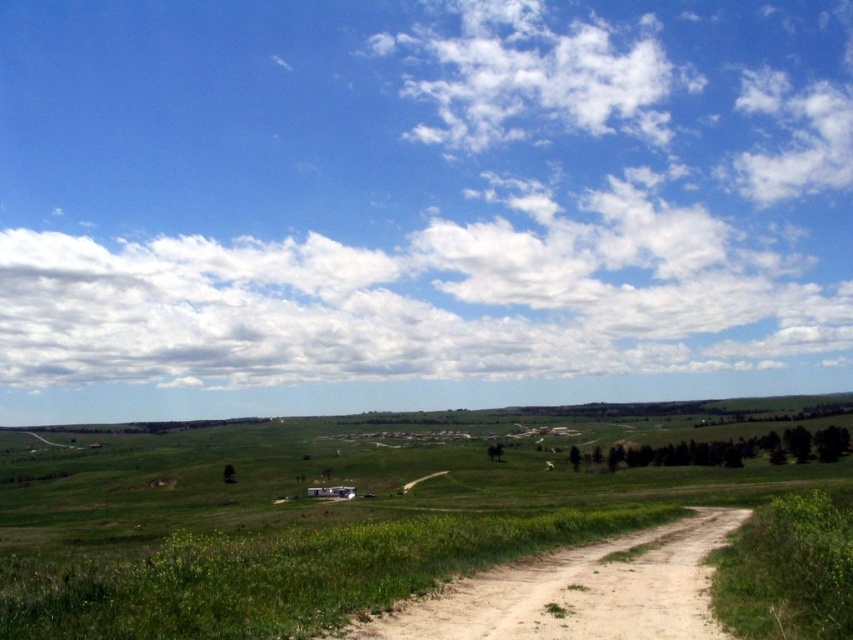
Question: Which point is farther from the camera taking this photo?

Choices:
 (A) (13, 492)
 (B) (407, 609)

Answer: (A)

Question: Does green grassy field at center have a greater width compared to brown sandy dirt track at lower right?

Choices:
 (A) yes
 (B) no

Answer: (A)

Question: Which object is farther from the camera taking this photo?

Choices:
 (A) green grassy field at center
 (B) brown sandy dirt track at lower right

Answer: (A)

Question: Considering the relative positions of green grassy field at center and brown sandy dirt track at lower right in the image provided, where is green grassy field at center located with respect to brown sandy dirt track at lower right?

Choices:
 (A) left
 (B) right

Answer: (A)

Question: Can you confirm if green grassy field at center is smaller than brown sandy dirt track at lower right?

Choices:
 (A) yes
 (B) no

Answer: (B)